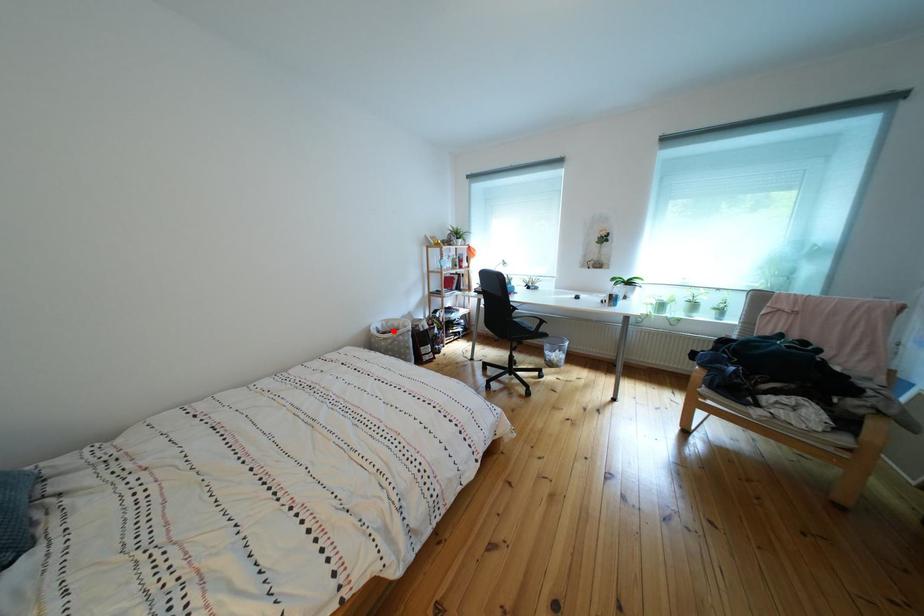
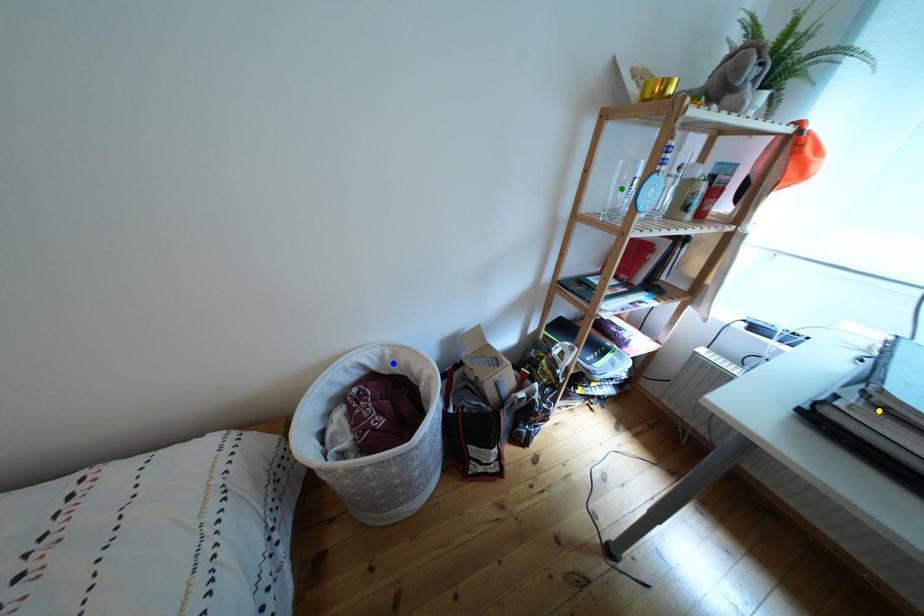
Question: I am providing you with two images of the same scene from different viewpoints. A red point is marked on the first image. You are given multiple points on the second image. In image 2, which mark is for the same physical point as the one in image 1?

Choices:
 (A) green point
 (B) blue point
 (C) yellow point

Answer: (B)